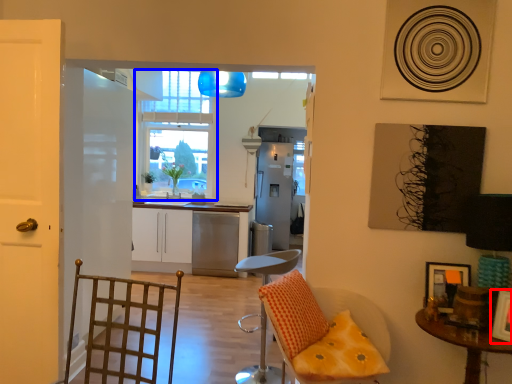
Question: Which object is closer to the camera taking this photo, picture frame (highlighted by a red box) or window (highlighted by a blue box)?

Choices:
 (A) picture frame
 (B) window

Answer: (A)